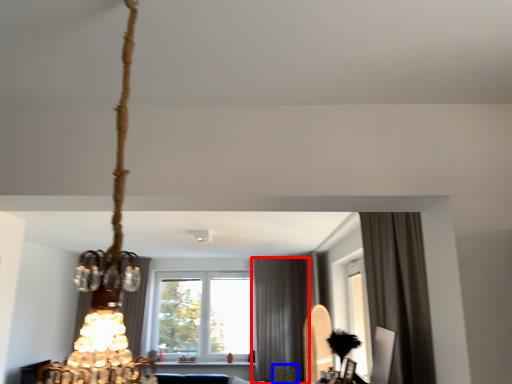
Question: Which point is closer to the camera, curtain (highlighted by a red box) or plant (highlighted by a blue box)?

Choices:
 (A) curtain
 (B) plant

Answer: (B)